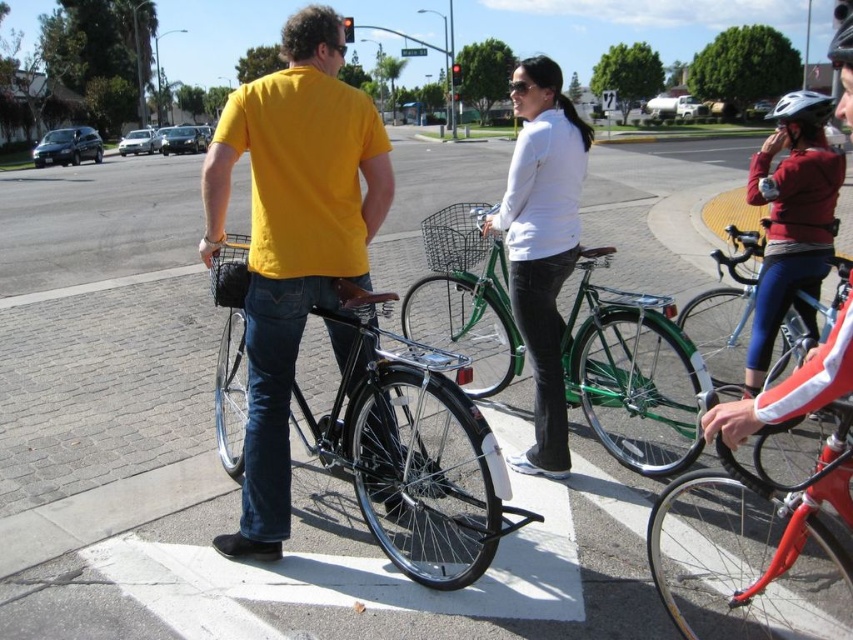
You are a delivery person who needs to choose between the shiny red bicycle at lower right and the black matte helmet at upper right. Which item is more suitable for carrying packages?

The black matte helmet at upper right is more suitable for carrying packages because it is larger than the shiny red bicycle at lower right.

You are a delivery person who needs to load a package onto your bicycle. You see the shiny red bicycle at lower right and the green metallic bicycle at center. Which bicycle is closer to the right edge of the image?

The shiny red bicycle at lower right is positioned on the right side of green metallic bicycle at center, so it is closer to the right edge of the image.